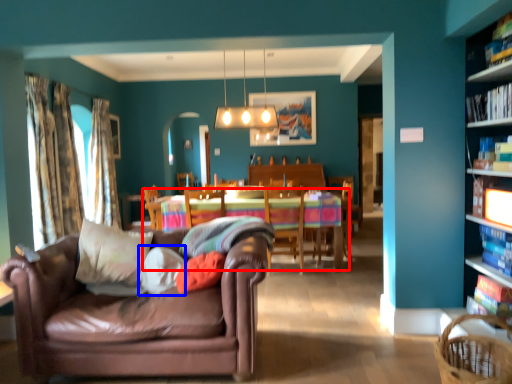
Question: Which point is closer to the camera, kitchen & dining room table (highlighted by a red box) or pillow (highlighted by a blue box)?

Choices:
 (A) kitchen & dining room table
 (B) pillow

Answer: (B)